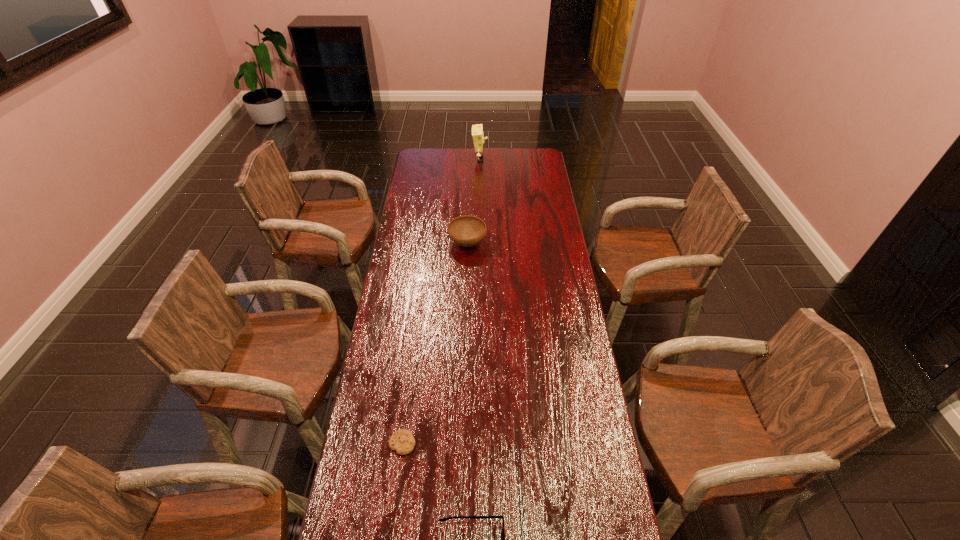
Where is `object located at the left edge`? Image resolution: width=960 pixels, height=540 pixels. object located at the left edge is located at coordinates (402, 441).

The image size is (960, 540). I want to click on vacant space at the far edge of the desktop, so click(468, 163).

The width and height of the screenshot is (960, 540). Identify the location of blank area at the left edge. (402, 304).

Where is `vacant region at the right edge of the desktop`? The image size is (960, 540). vacant region at the right edge of the desktop is located at coordinates (552, 214).

You are a GUI agent. You are given a task and a screenshot of the screen. Output one action in this format:
    pyautogui.click(x=<x>, y=<y>)
    Task: Click on the vacant region at the far left corner of the desktop
    This screenshot has height=540, width=960.
    Given the screenshot: What is the action you would take?
    pyautogui.click(x=424, y=158)

Locate an element on the screen. blank space at the far right corner of the desktop is located at coordinates (535, 165).

Locate an element on the screen. The width and height of the screenshot is (960, 540). blank region between the cookie and the farthest object is located at coordinates (441, 301).

Find the location of a particular element. The image size is (960, 540). vacant point located between the leftmost object and the bowl is located at coordinates (435, 343).

This screenshot has width=960, height=540. In order to click on free area in between the tallest object and the bowl in this screenshot , I will do `click(473, 201)`.

Identify the location of free space between the farthest object and the shortest object. This screenshot has height=540, width=960. (441, 301).